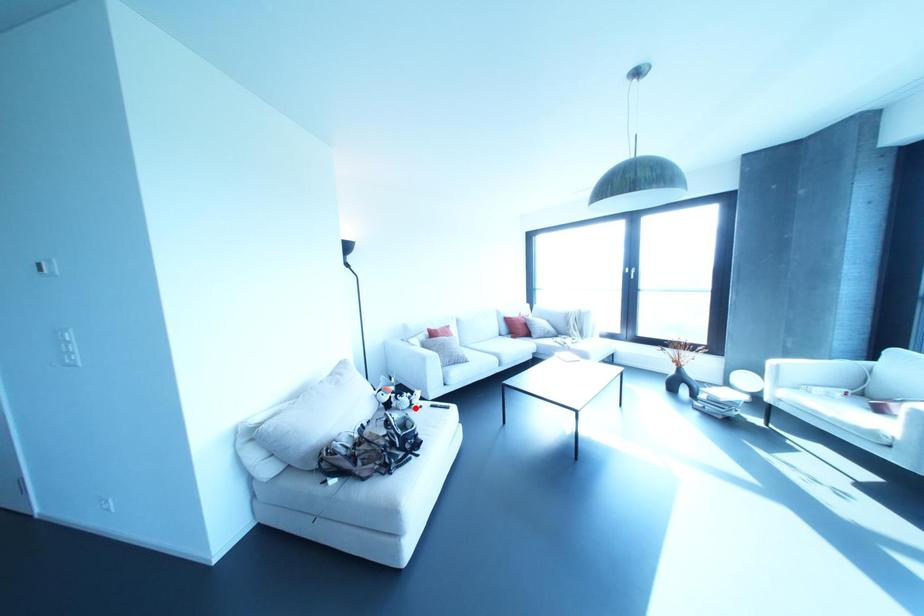
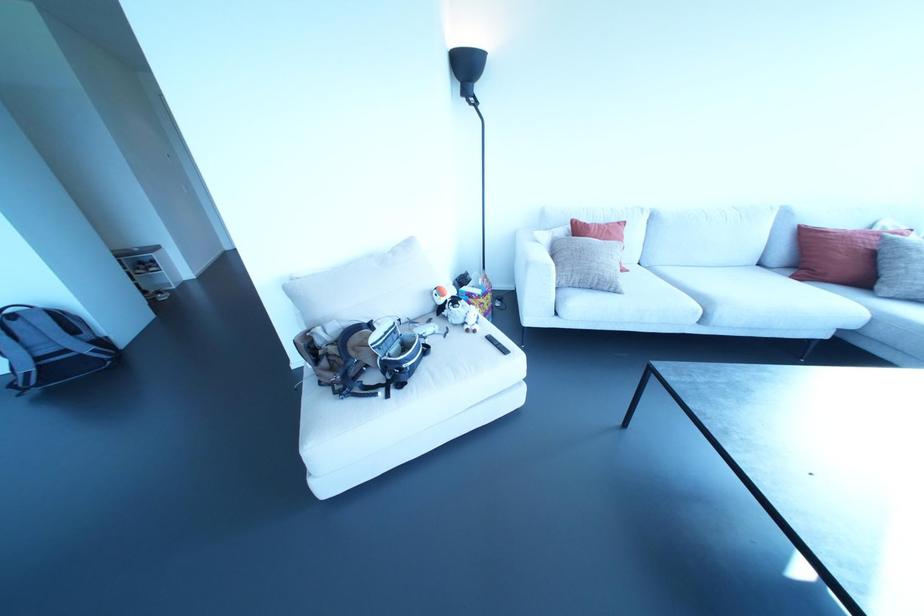
Question: I am providing you with two images of the same scene from different viewpoints. A red point is shown in image1. For the corresponding object point in image2, is it positioned nearer or farther from the camera?

Choices:
 (A) Nearer
 (B) Farther

Answer: (B)